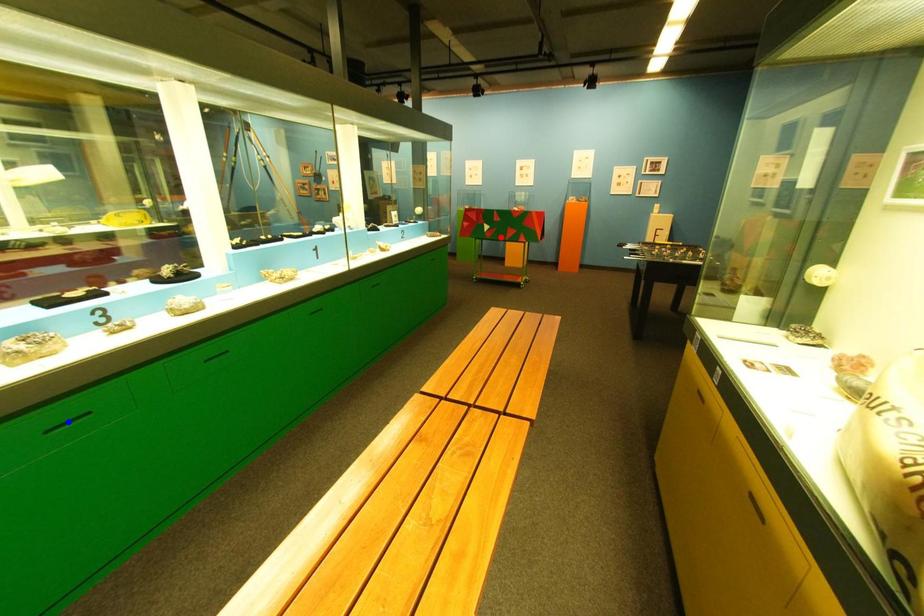
Question: Which of the two points in the image is closer to the camera?

Choices:
 (A) Blue point is closer.
 (B) Red point is closer.

Answer: (A)